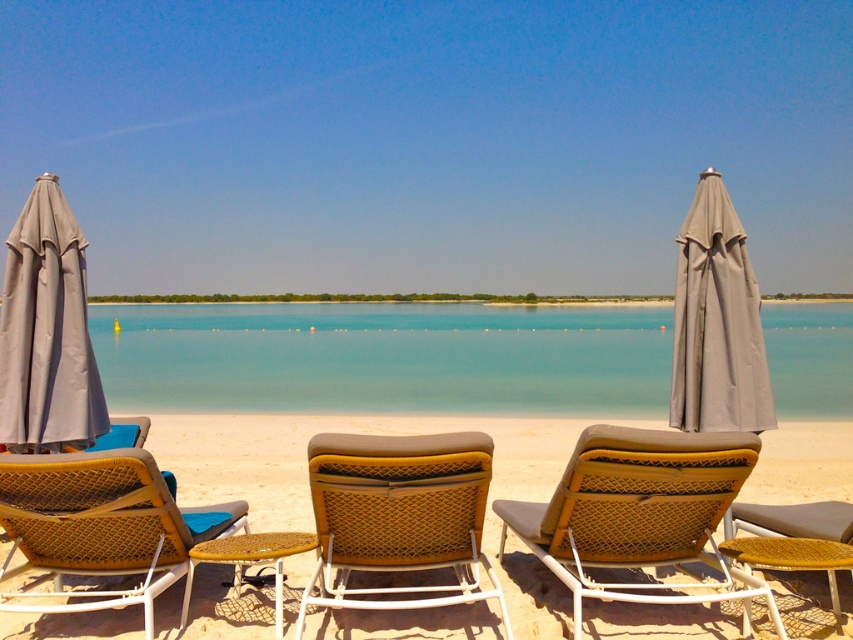
Who is higher up, clear blue water at center or woven brown beach chair at center?

clear blue water at center is higher up.

Between clear blue water at center and woven brown beach chair at center, which one has less height?

With less height is woven brown beach chair at center.

Who is more forward, (131, 348) or (838, 524)?

Point (838, 524)

Where is `clear blue water at center`? The image size is (853, 640). clear blue water at center is located at coordinates (386, 356).

Does point (485, 563) lie in front of point (167, 490)?

No, (485, 563) is behind (167, 490).

Is point (325, 472) farther from viewer compared to point (152, 548)?

That is False.

Where is `woven fabric beach chair at center`? The height and width of the screenshot is (640, 853). woven fabric beach chair at center is located at coordinates (399, 515).

Who is more forward, (291, 404) or (112, 451)?

Point (112, 451) is in front.

Who is higher up, clear blue water at center or woven brown beach chair at lower left?

Positioned higher is clear blue water at center.

Is point (791, 344) closer to viewer compared to point (68, 538)?

No, (791, 344) is behind (68, 538).

Find the location of a particular element. Image resolution: width=853 pixels, height=640 pixels. clear blue water at center is located at coordinates [x=386, y=356].